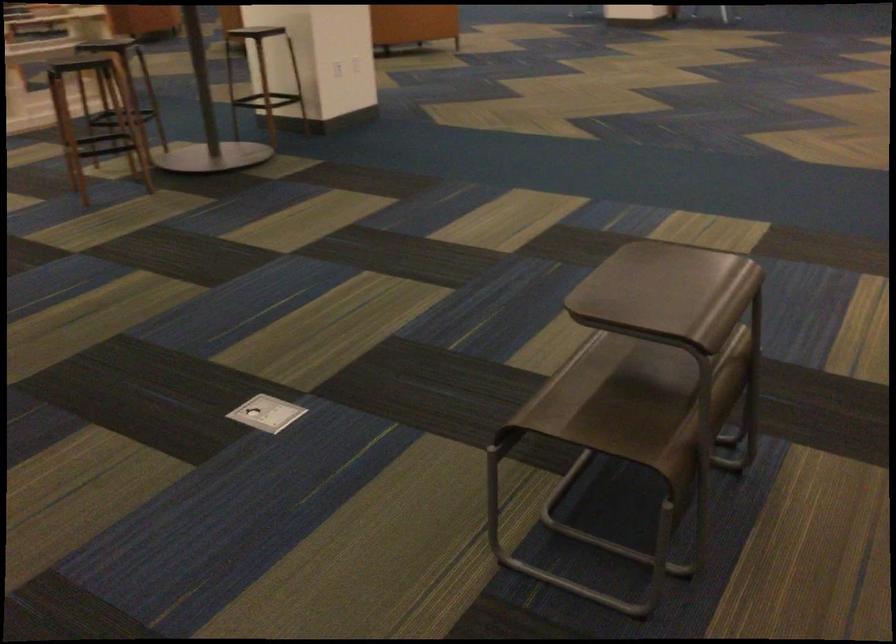
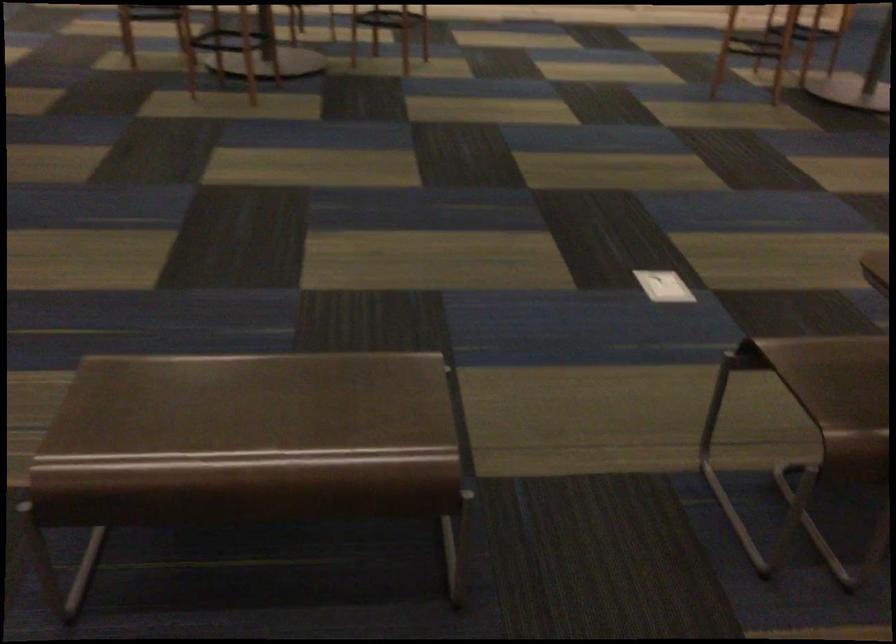
In the second image, find the point that corresponds to (x=574, y=413) in the first image.

(823, 366)